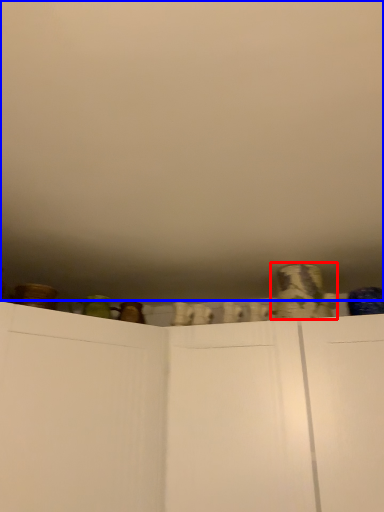
Question: Which of the following is the closest to the observer, pottery (highlighted by a red box) or backdrop (highlighted by a blue box)?

Choices:
 (A) pottery
 (B) backdrop

Answer: (B)